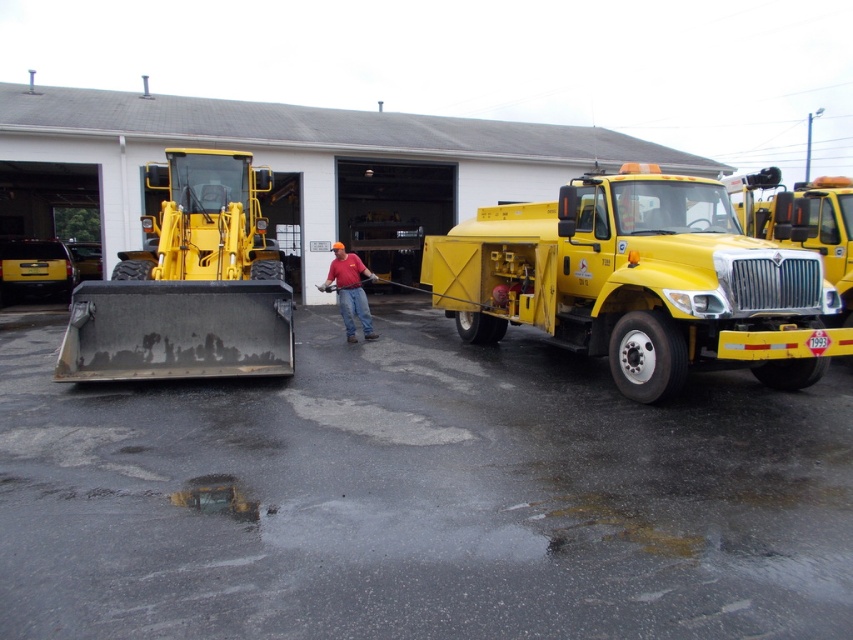
Is yellow matte truck at center wider than matte black forklift at left?

Correct, the width of yellow matte truck at center exceeds that of matte black forklift at left.

Can you confirm if yellow matte truck at center is shorter than matte black forklift at left?

Correct, yellow matte truck at center is not as tall as matte black forklift at left.

At what (x,y) coordinates should I click in order to perform the action: click on yellow matte truck at center. Please return your answer as a coordinate pair (x, y). Image resolution: width=853 pixels, height=640 pixels. Looking at the image, I should click on (639, 282).